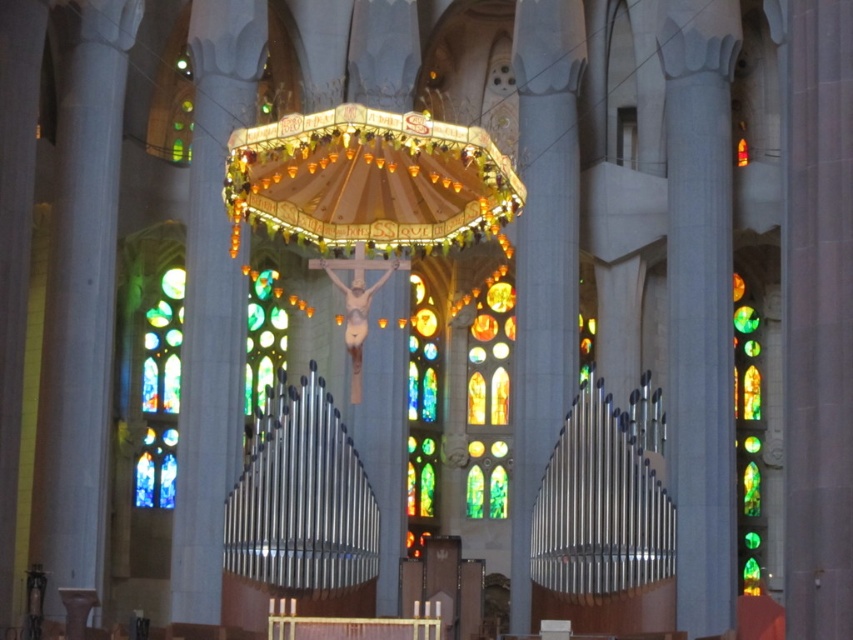
Which is above, translucent stained glass at center or stained glass window at center?

stained glass window at center is above.

Does translucent stained glass at center have a smaller size compared to stained glass window at center?

Yes, translucent stained glass at center is smaller than stained glass window at center.

Identify the location of translucent stained glass at center. (490, 358).

In order to click on translucent stained glass at center in this screenshot , I will do `click(490, 358)`.

Between point (480, 394) and point (175, 276), which one is positioned in front?

Point (175, 276) is more forward.

Image resolution: width=853 pixels, height=640 pixels. What are the coordinates of `translucent stained glass at center` in the screenshot? It's located at (490, 358).

Is stained glass window at right bigger than multicolored stained glass at center?

Indeed, stained glass window at right has a larger size compared to multicolored stained glass at center.

Based on the photo, measure the distance from stained glass window at right to multicolored stained glass at center.

stained glass window at right and multicolored stained glass at center are 17.59 meters apart from each other.

Where is `stained glass window at right`? The image size is (853, 640). stained glass window at right is located at coordinates 747,440.